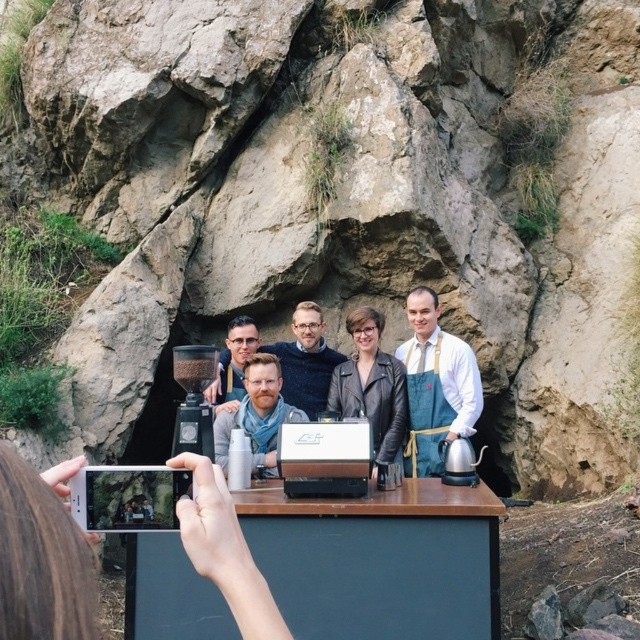
You are a photographer standing 10 feet away from the blue apron at center and the matte black shirt at center. Can you fit both subjects into your camera frame without moving closer or farther?

The distance between the blue apron at center and the matte black shirt at center is 6.91 feet. Since you are 10 feet away from both subjects, the separation between them is less than your distance, so they can both fit in the frame without needing to adjust your position.

You are standing in front of the rustic setting with the wooden table. You need to place a small note on the white matte phone at lower left. Where exactly should you place it according to the coordinates provided?

The white matte phone at lower left should be placed at coordinates point (42, 554).